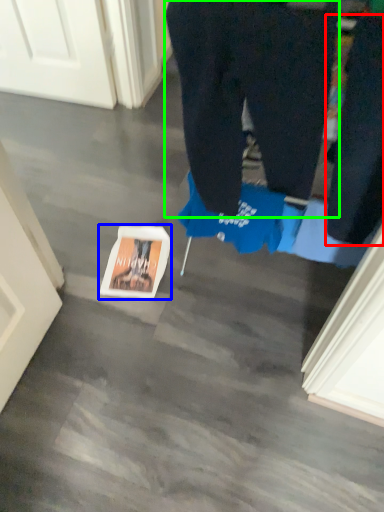
Question: Estimate the real-world distances between objects in this image. Which object is closer to pants (highlighted by a red box), copy (highlighted by a blue box) or trousers (highlighted by a green box)?

Choices:
 (A) copy
 (B) trousers

Answer: (B)